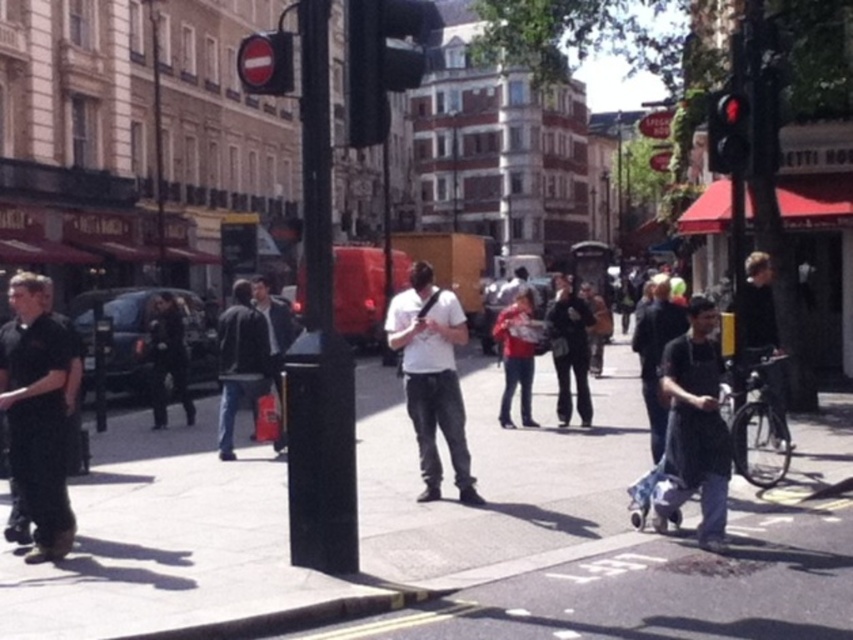
Question: Which of the following is the farthest from the observer?

Choices:
 (A) dark gray fabric skateboard at center right
 (B) smooth concrete sidewalk at center
 (C) black matte shirt at left

Answer: (A)

Question: Can you confirm if smooth concrete sidewalk at center is positioned below white matte shirt at center?

Choices:
 (A) no
 (B) yes

Answer: (B)

Question: Which of the following is the farthest from the observer?

Choices:
 (A) (732, 93)
 (B) (425, 317)
 (C) (401, 49)

Answer: (A)

Question: In this image, where is black matte shirt at left located relative to dark gray fabric skateboard at center right?

Choices:
 (A) left
 (B) right

Answer: (A)

Question: Is black matte shirt at left wider than white matte shirt at center?

Choices:
 (A) yes
 (B) no

Answer: (A)

Question: Which object is closer to the camera taking this photo?

Choices:
 (A) smooth concrete sidewalk at center
 (B) dark blue jeans at center
 (C) black matte shirt at left

Answer: (A)